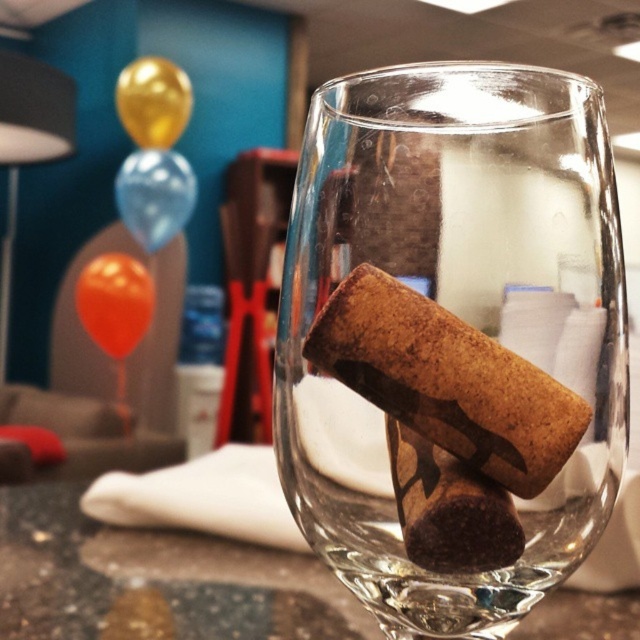
Which is above, translucent glass table at center or orange matte balloon at upper left?

orange matte balloon at upper left

Can you confirm if translucent glass table at center is smaller than orange matte balloon at upper left?

No.

Between point (61, 612) and point (134, 320), which one is positioned in front?

Positioned in front is point (61, 612).

The height and width of the screenshot is (640, 640). I want to click on translucent glass table at center, so click(x=154, y=580).

Which is below, blue glossy balloon at upper left or gold metallic balloon at upper left?

blue glossy balloon at upper left is lower down.

Who is shorter, blue glossy balloon at upper left or gold metallic balloon at upper left?

gold metallic balloon at upper left

Who is more forward, (156, 241) or (152, 76)?

Point (152, 76) is more forward.

Where is `blue glossy balloon at upper left`? This screenshot has width=640, height=640. blue glossy balloon at upper left is located at coordinates (154, 195).

Is orange matte balloon at upper left positioned at the back of gold metallic balloon at upper left?

Yes, it is behind gold metallic balloon at upper left.

I want to click on orange matte balloon at upper left, so pyautogui.click(x=115, y=301).